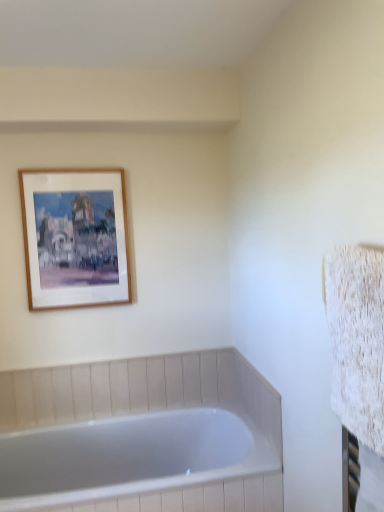
Question: Is wooden frame at upper left to the left or to the right of white glossy bathtub at lower left in the image?

Choices:
 (A) left
 (B) right

Answer: (A)

Question: Is point (112, 287) closer or farther from the camera than point (9, 441)?

Choices:
 (A) farther
 (B) closer

Answer: (A)

Question: Is wooden frame at upper left inside the boundaries of white glossy bathtub at lower left, or outside?

Choices:
 (A) outside
 (B) inside

Answer: (A)

Question: Looking at the image, does white glossy bathtub at lower left seem bigger or smaller compared to wooden frame at upper left?

Choices:
 (A) small
 (B) big

Answer: (B)

Question: Do you think white glossy bathtub at lower left is within wooden frame at upper left, or outside of it?

Choices:
 (A) outside
 (B) inside

Answer: (A)

Question: From the image's perspective, is white glossy bathtub at lower left above or below wooden frame at upper left?

Choices:
 (A) below
 (B) above

Answer: (A)

Question: From a real-world perspective, is white glossy bathtub at lower left above or below wooden frame at upper left?

Choices:
 (A) above
 (B) below

Answer: (B)